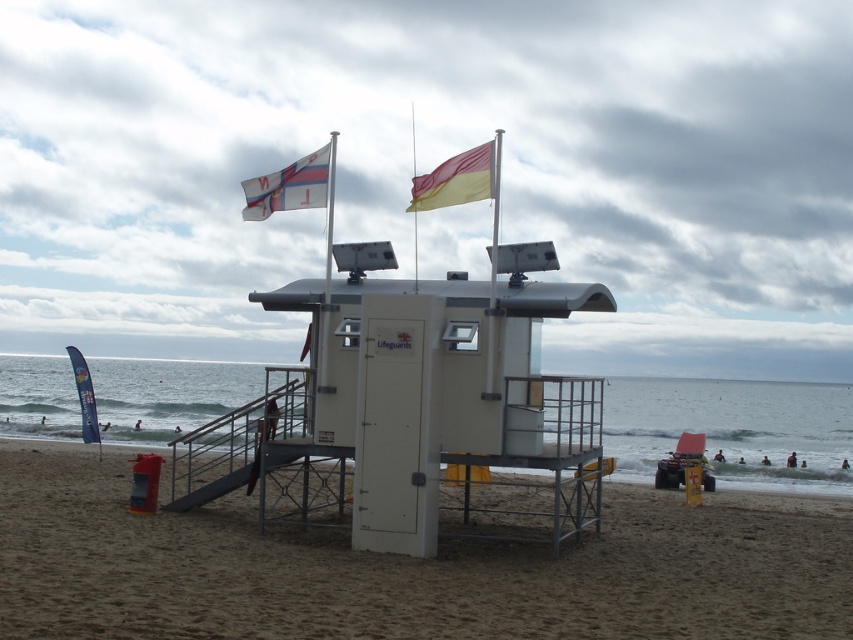
Question: Which of the following is the closest to the observer?

Choices:
 (A) (456, 182)
 (B) (543, 624)
 (C) (247, 216)

Answer: (B)

Question: In this image, where is sandy brown at center located relative to white fabric flag at upper center?

Choices:
 (A) below
 (B) above

Answer: (A)

Question: Which of the following is the farthest from the observer?

Choices:
 (A) (456, 605)
 (B) (461, 164)
 (C) (323, 157)

Answer: (C)

Question: Does white fabric flag at upper center have a greater width compared to yellow matte flag at upper center?

Choices:
 (A) no
 (B) yes

Answer: (B)

Question: Can you confirm if sandy brown at center is positioned to the left of white fabric flag at upper center?

Choices:
 (A) no
 (B) yes

Answer: (B)

Question: Which point is farther to the camera?

Choices:
 (A) (486, 145)
 (B) (619, 504)

Answer: (B)